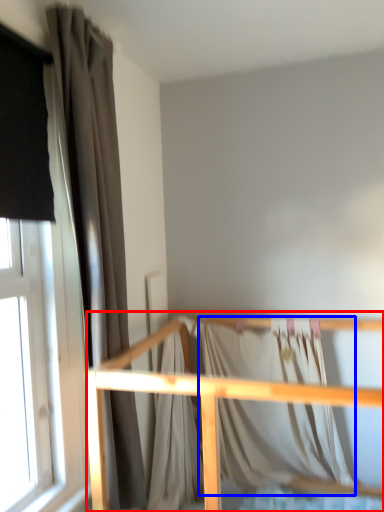
Question: Which object appears farthest to the camera in this image, rail (highlighted by a red box) or blanket (highlighted by a blue box)?

Choices:
 (A) rail
 (B) blanket

Answer: (B)